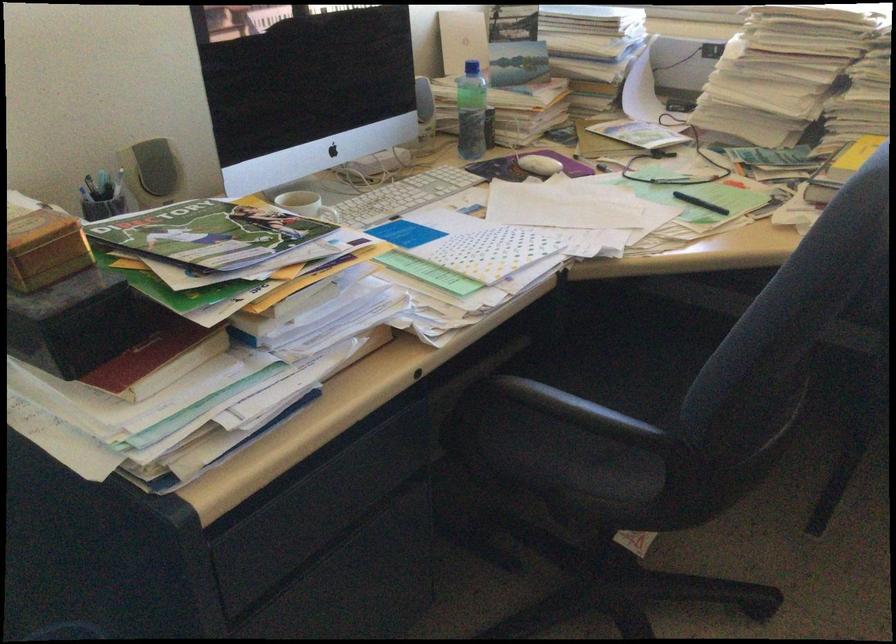
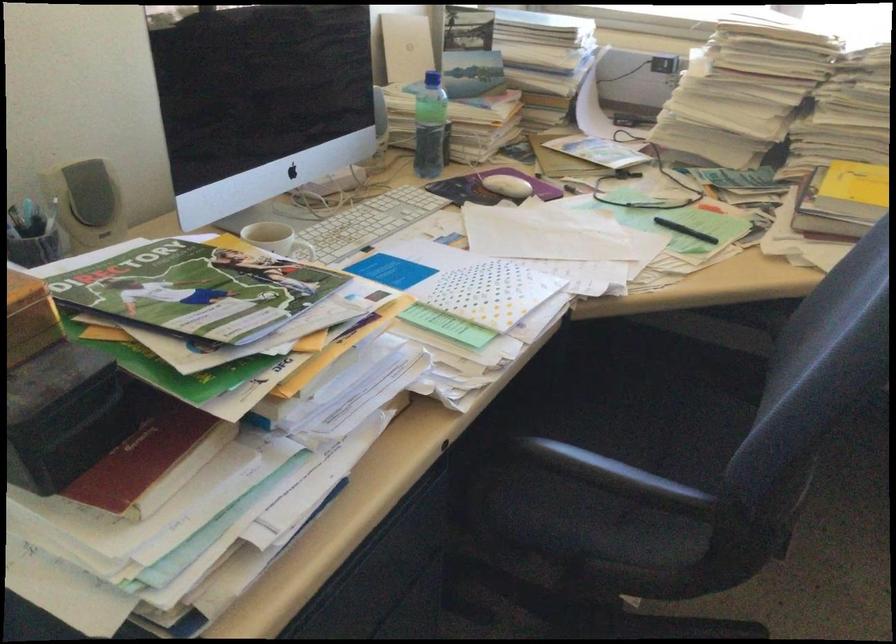
Where in the second image is the point corresponding to pixel 702 200 from the first image?

(684, 230)